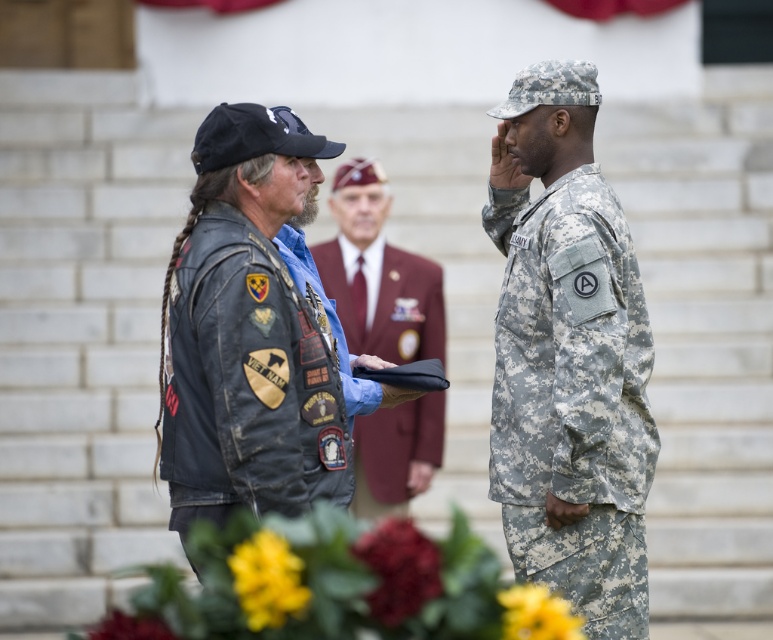
Question: Can you confirm if camouflage fabric uniform at right is positioned above maroon fabric suit at center?

Choices:
 (A) yes
 (B) no

Answer: (B)

Question: Can you confirm if leather jacket at left is thinner than maroon fabric suit at center?

Choices:
 (A) no
 (B) yes

Answer: (B)

Question: Which point is closer to the camera taking this photo?

Choices:
 (A) (407, 484)
 (B) (540, 480)
 (C) (288, 288)

Answer: (C)

Question: Can you confirm if leather jacket at left is bigger than maroon fabric suit at center?

Choices:
 (A) no
 (B) yes

Answer: (B)

Question: Which is farther from the camouflage fabric uniform at right?

Choices:
 (A) maroon fabric suit at center
 (B) leather jacket at left

Answer: (A)

Question: Which object is the farthest from the maroon fabric suit at center?

Choices:
 (A) camouflage fabric uniform at right
 (B) leather jacket at left

Answer: (B)